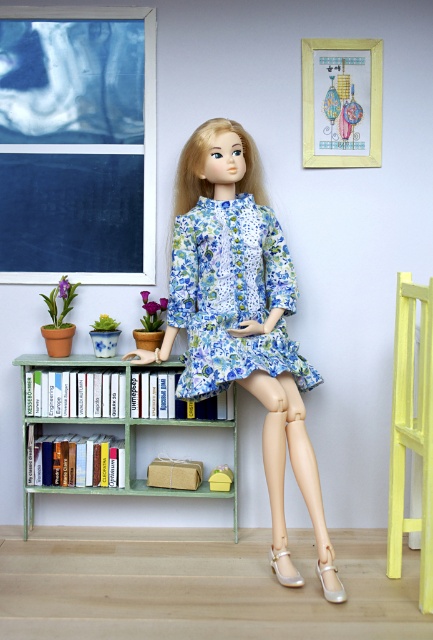
Is yellow painted wood chair at right below wooden frame at upper center?

Yes.

Between yellow painted wood chair at right and wooden frame at upper center, which one is positioned lower?

Positioned lower is yellow painted wood chair at right.

Which is behind, point (427, 403) or point (341, 161)?

Point (341, 161)

Where is `yellow painted wood chair at right`? The image size is (433, 640). yellow painted wood chair at right is located at coordinates (412, 428).

Could you measure the distance between floral-patterned fabric dress at center and green painted wood bookshelf at lower center?

floral-patterned fabric dress at center and green painted wood bookshelf at lower center are 20.06 inches apart.

Can you confirm if floral-patterned fabric dress at center is positioned above green painted wood bookshelf at lower center?

Indeed, floral-patterned fabric dress at center is positioned over green painted wood bookshelf at lower center.

Who is more distant from viewer, (239,221) or (129,380)?

Positioned behind is point (129,380).

Where is `floral-patterned fabric dress at center`? This screenshot has height=640, width=433. floral-patterned fabric dress at center is located at coordinates (232, 296).

Does green painted wood bookshelf at lower center appear on the left side of wooden frame at upper center?

Yes, green painted wood bookshelf at lower center is to the left of wooden frame at upper center.

Which is behind, point (129, 440) or point (352, 84)?

Positioned behind is point (352, 84).

This screenshot has height=640, width=433. What are the coordinates of `green painted wood bookshelf at lower center` in the screenshot? It's located at (96, 424).